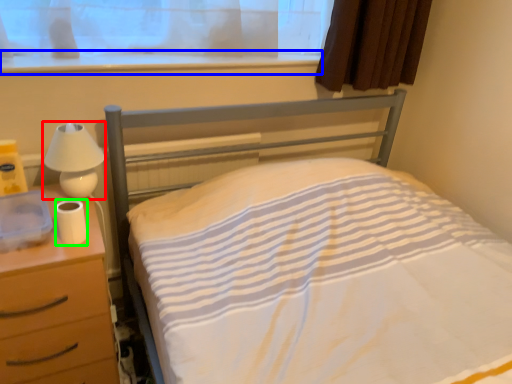
Question: Considering the real-world distances, which object is farthest from lamp (highlighted by a red box)? window sill (highlighted by a blue box) or toilet paper (highlighted by a green box)?

Choices:
 (A) window sill
 (B) toilet paper

Answer: (A)